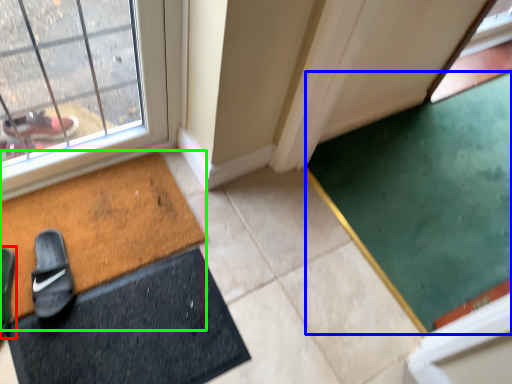
Question: Which object is the closest to the footwear (highlighted by a red box)? Choose among these: doormat (highlighted by a blue box) or bath mat (highlighted by a green box).

Choices:
 (A) doormat
 (B) bath mat

Answer: (B)